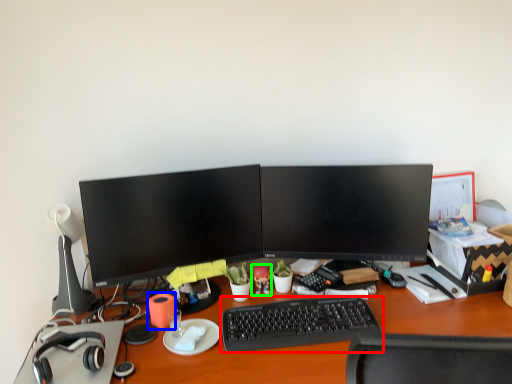
Question: Which object is the farthest from computer keyboard (highlighted by a red box)? Choose among these: stationery (highlighted by a blue box) or toy (highlighted by a green box).

Choices:
 (A) stationery
 (B) toy

Answer: (A)